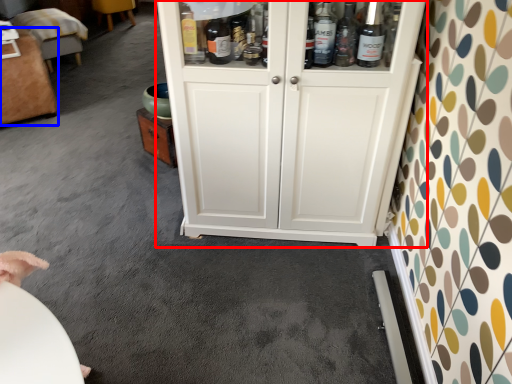
Question: Among these objects, which one is nearest to the camera, cupboard (highlighted by a red box) or furniture (highlighted by a blue box)?

Choices:
 (A) cupboard
 (B) furniture

Answer: (A)